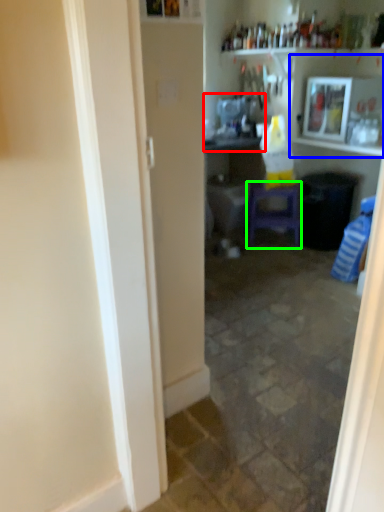
Question: Which object is the farthest from sink (highlighted by a red box)? Choose among these: shelf (highlighted by a blue box) or furniture (highlighted by a green box).

Choices:
 (A) shelf
 (B) furniture

Answer: (B)